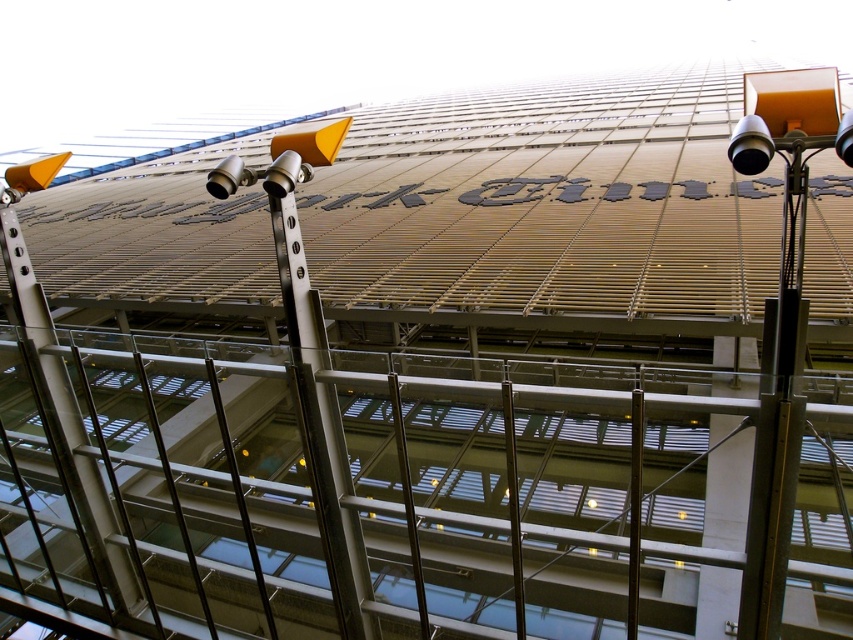
You are standing at the base of the Bank of America building and notice two poles in front of you. Which pole, the black metal pole at center or the polished silver pole at center, is closer to you?

The black metal pole at center is closer to you because it is in front of the polished silver pole at center.